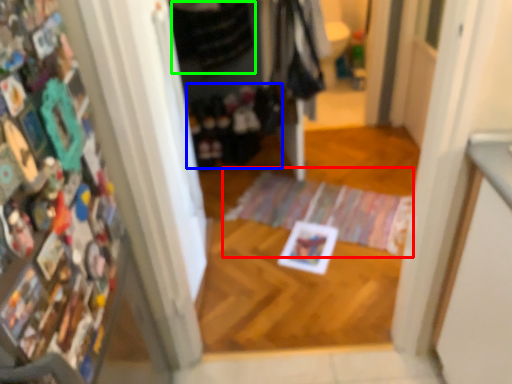
Question: Which is farther away from doormat (highlighted by a red box)? clothing (highlighted by a blue box) or clothing (highlighted by a green box)?

Choices:
 (A) clothing
 (B) clothing

Answer: (B)